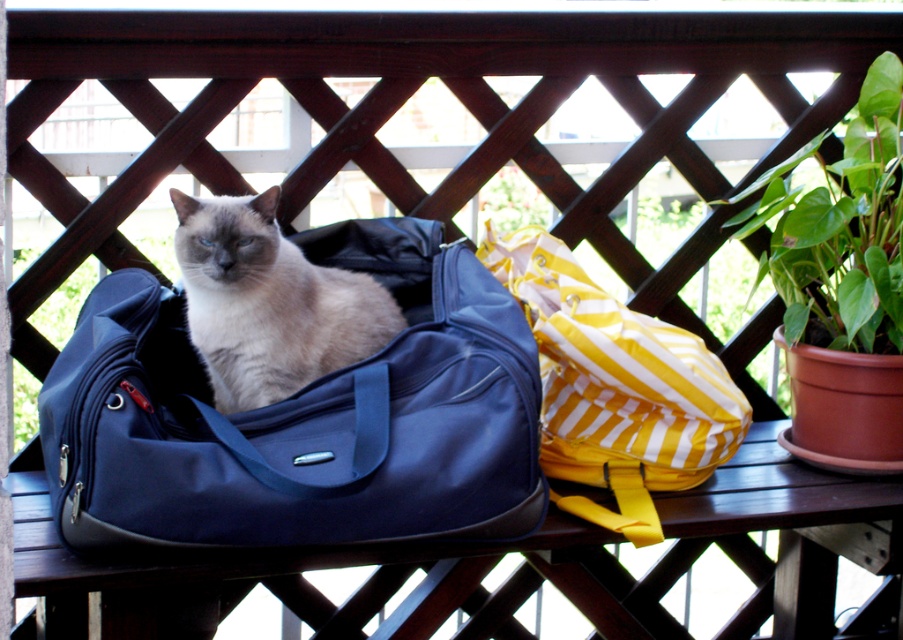
You are a delivery person who needs to place a new bag on the patio. The new bag must be placed on the same bench as the existing bags. The new bag is 10 cm taller than the smokey gray fur at center. Can the new bag fit on the bench without exceeding the height of the existing matte blue duffel bag at center?

The matte blue duffel bag at center is taller than the smokey gray fur at center. Since the new bag is 10 cm taller than the smokey gray fur at center, it would be shorter than the existing matte blue duffel bag at center. Therefore, the new bag can fit on the bench without exceeding the height of the matte blue duffel bag at center.

You are a delivery person who needs to place a new package on the balcony. The package is 1.2 meters wide. Can you place it between the matte blue duffel bag at center and the green leafy plant at upper left without moving either object?

The matte blue duffel bag at center is in front of the green leafy plant at upper left, so there is no space between them for the package to be placed. Therefore, you cannot place the package between them without moving either object.